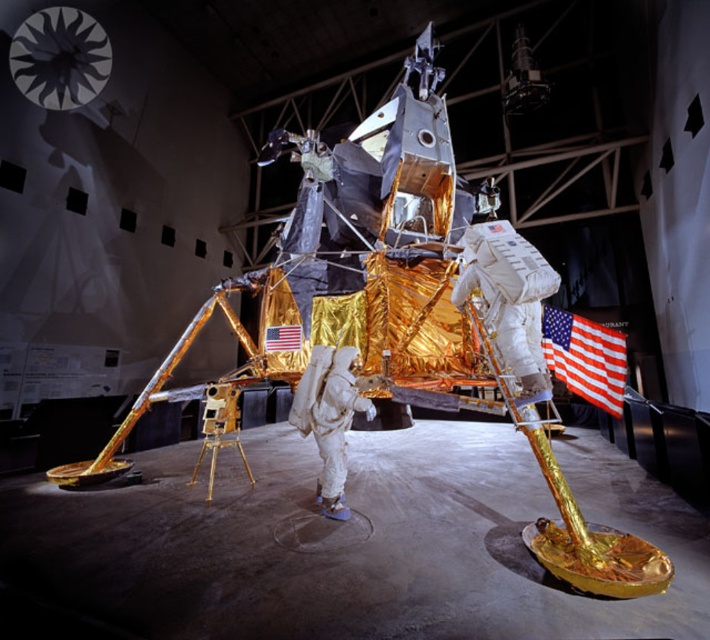
Who is more distant from viewer, [667,499] or [60,38]?

Positioned behind is point [60,38].

Between point (408, 627) and point (62, 96), which one is positioned in front?

Positioned in front is point (408, 627).

Where is `gold reflective lunar module at center`? This screenshot has width=710, height=640. gold reflective lunar module at center is located at coordinates (351, 541).

Which is in front, point (628, 616) or point (578, 378)?

Positioned in front is point (628, 616).

Is point (158, 468) farther from camera compared to point (569, 369)?

That is True.

Find the location of a particular element. gold reflective lunar module at center is located at coordinates (351, 541).

This screenshot has height=640, width=710. What do you see at coordinates (60, 58) in the screenshot?
I see `metallic silver moon at upper left` at bounding box center [60, 58].

Image resolution: width=710 pixels, height=640 pixels. What are the coordinates of `metallic silver moon at upper left` in the screenshot? It's located at (60, 58).

This screenshot has width=710, height=640. In order to click on metallic silver moon at upper left in this screenshot , I will do `click(60, 58)`.

This screenshot has width=710, height=640. I want to click on metallic silver moon at upper left, so click(60, 58).